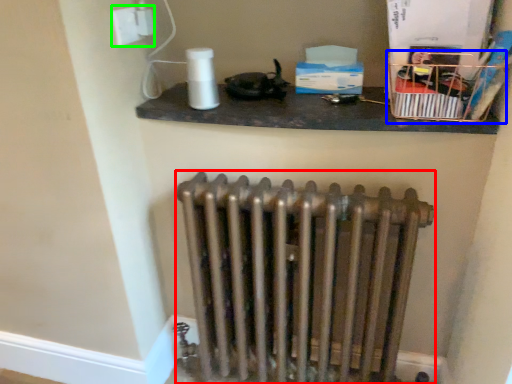
Question: Which object is positioned farthest from radiator (highlighted by a red box)? Select from crate (highlighted by a blue box) and electric outlet (highlighted by a green box).

Choices:
 (A) crate
 (B) electric outlet

Answer: (B)